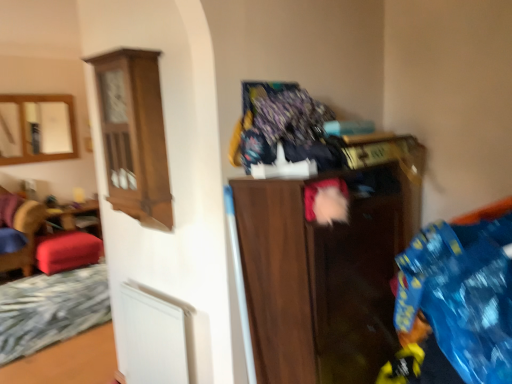
Find the location of `wooden cabinet at left`. wooden cabinet at left is located at coordinates (134, 135).

What is the approximate height of white matte bed frame at lower left?

white matte bed frame at lower left is 2.16 inches in height.

What do you see at coordinates (67, 251) in the screenshot? I see `velvet red stool at left` at bounding box center [67, 251].

Where is `velvet red stool at left`? velvet red stool at left is located at coordinates (67, 251).

Locate an element on the screen. This screenshot has width=512, height=384. wooden cabinet at left is located at coordinates (134, 135).

From their relative heights in the image, would you say wooden cabinet at left is taller or shorter than white matte bed frame at lower left?

Considering their sizes, wooden cabinet at left has more height than white matte bed frame at lower left.

You are a GUI agent. You are given a task and a screenshot of the screen. Output one action in this format:
    pyautogui.click(x=<x>, y=<y>)
    Task: Click on the cabinetry that is above the white matte bed frame at lower left (from a real-world perspective)
    
    Given the screenshot: What is the action you would take?
    pyautogui.click(x=134, y=135)

From the image's perspective, which one is positioned lower, wooden cabinet at left or white matte bed frame at lower left?

white matte bed frame at lower left.

From the image's perspective, is matte wood mirror at upper left located above or below velvet red stool at left?

matte wood mirror at upper left is situated higher than velvet red stool at left in the image.

Based on the photo, is matte wood mirror at upper left facing towards velvet red stool at left?

No, matte wood mirror at upper left is not oriented towards velvet red stool at left.

Which is behind, matte wood mirror at upper left or velvet red stool at left?

matte wood mirror at upper left is behind.

Can you confirm if matte wood mirror at upper left is positioned to the left of velvet red stool at left?

Correct, you'll find matte wood mirror at upper left to the left of velvet red stool at left.

Measure the distance between dark wood cabinet at center and velvet red stool at left.

dark wood cabinet at center and velvet red stool at left are 3.54 meters apart from each other.

Considering the relative sizes of dark wood cabinet at center and velvet red stool at left in the image provided, is dark wood cabinet at center smaller than velvet red stool at left?

No.

Would you say velvet red stool at left is part of dark wood cabinet at center's contents?

No.

Does dark wood cabinet at center have a greater width compared to velvet red stool at left?

No.

In terms of height, does dark wood cabinet at center look taller or shorter compared to white matte bed frame at lower left?

In the image, dark wood cabinet at center appears to be taller than white matte bed frame at lower left.

Are dark wood cabinet at center and white matte bed frame at lower left located far from each other?

dark wood cabinet at center is far away from white matte bed frame at lower left.

From a real-world perspective, is dark wood cabinet at center above or below white matte bed frame at lower left?

Clearly, from a real-world perspective, dark wood cabinet at center is above white matte bed frame at lower left.

From the image's perspective, which object appears higher, wooden cabinet at left or velvet red stool at left?

wooden cabinet at left is shown above in the image.

In the image, is wooden cabinet at left positioned in front of or behind velvet red stool at left?

Clearly, wooden cabinet at left is in front of velvet red stool at left.

Is point (153, 91) positioned behind point (46, 244)?

That is False.

Are wooden cabinet at left and velvet red stool at left far apart?

Yes, wooden cabinet at left and velvet red stool at left are quite far apart.

Looking at this image, considering the relative sizes of fluffy multicolored blanket at upper center and wooden cabinet at left in the image provided, is fluffy multicolored blanket at upper center smaller than wooden cabinet at left?

Yes.

From a real-world perspective, which is physically below, fluffy multicolored blanket at upper center or wooden cabinet at left?

From a 3D spatial view, wooden cabinet at left is below.

From the image's perspective, which object appears higher, fluffy multicolored blanket at upper center or wooden cabinet at left?

fluffy multicolored blanket at upper center is shown above in the image.

Can you see white matte bed frame at lower left touching dark wood cabinet at center?

No, white matte bed frame at lower left is not beside dark wood cabinet at center.

Which object is further away from the camera taking this photo, white matte bed frame at lower left or dark wood cabinet at center?

white matte bed frame at lower left is behind.

From the image's perspective, does white matte bed frame at lower left appear higher than dark wood cabinet at center?

Incorrect, from the image's perspective, white matte bed frame at lower left is lower than dark wood cabinet at center.

This screenshot has height=384, width=512. What are the coordinates of `cabinetry on the right of white matte bed frame at lower left` in the screenshot? It's located at (134, 135).

Identify the location of mirror behind the velvet red stool at left. The image size is (512, 384). (37, 128).

Consider the image. Which object lies nearer to the anchor point fluffy multicolored blanket at upper center, wooden cabinet at left or white matte bed frame at lower left?

The object closer to fluffy multicolored blanket at upper center is wooden cabinet at left.

Looking at the image, which one is located closer to velvet red stool at left, dark wood cabinet at center or matte wood mirror at upper left?

Based on the image, matte wood mirror at upper left appears to be nearer to velvet red stool at left.

Estimate the real-world distances between objects in this image. Which object is closer to velvet red stool at left, white matte bed frame at lower left or fluffy multicolored blanket at upper center?

white matte bed frame at lower left is closer to velvet red stool at left.

Which object lies nearer to the anchor point white matte bed frame at lower left, wooden cabinet at left or dark wood cabinet at center?

wooden cabinet at left is closer to white matte bed frame at lower left.

Estimate the real-world distances between objects in this image. Which object is further from fluffy multicolored blanket at upper center, matte wood mirror at upper left or wooden cabinet at left?

The object further to fluffy multicolored blanket at upper center is matte wood mirror at upper left.

In the scene shown: From the image, which object appears to be nearer to wooden cabinet at left, white matte bed frame at lower left or fluffy multicolored blanket at upper center?

fluffy multicolored blanket at upper center is positioned closer to the anchor wooden cabinet at left.

Considering their positions, is wooden cabinet at left positioned further to velvet red stool at left than matte wood mirror at upper left?

wooden cabinet at left lies further to velvet red stool at left than the other object.

In the scene shown: Which object lies further to the anchor point white matte bed frame at lower left, velvet red stool at left or wooden cabinet at left?

Among the two, wooden cabinet at left is located further to white matte bed frame at lower left.

You are a GUI agent. You are given a task and a screenshot of the screen. Output one action in this format:
    pyautogui.click(x=<x>, y=<y>)
    Task: Click on the cabinetry between dark wood cabinet at center and velvet red stool at left in the front-back direction
    This screenshot has width=512, height=384.
    Given the screenshot: What is the action you would take?
    pyautogui.click(x=134, y=135)

Identify the location of cabinetry between dark wood cabinet at center and matte wood mirror at upper left in the front-back direction. The image size is (512, 384). (134, 135).

Find the location of `laundry positioned between dark wood cabinet at center and velvet red stool at left from near to far`. laundry positioned between dark wood cabinet at center and velvet red stool at left from near to far is located at coordinates (282, 127).

I want to click on cabinetry between white matte bed frame at lower left and fluffy multicolored blanket at upper center from left to right, so click(134, 135).